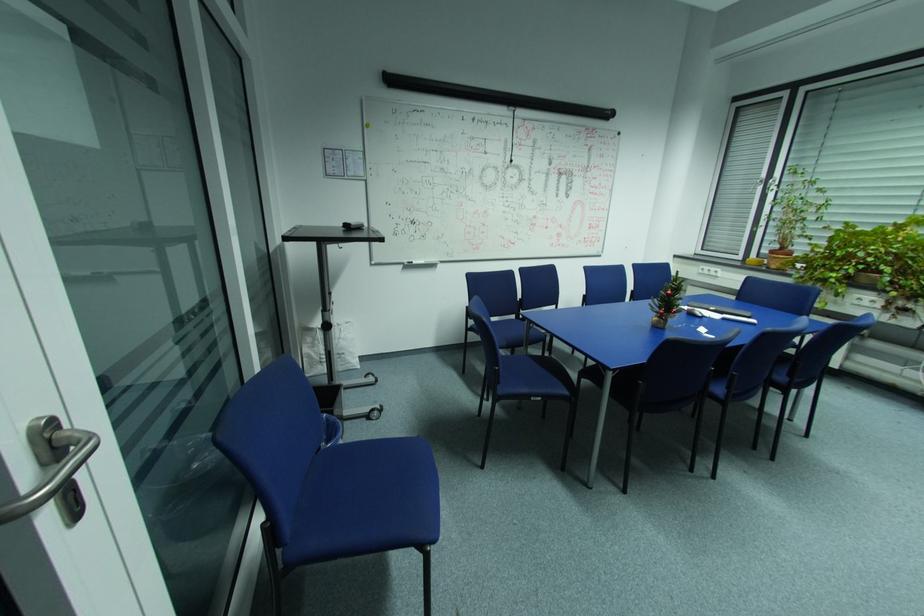
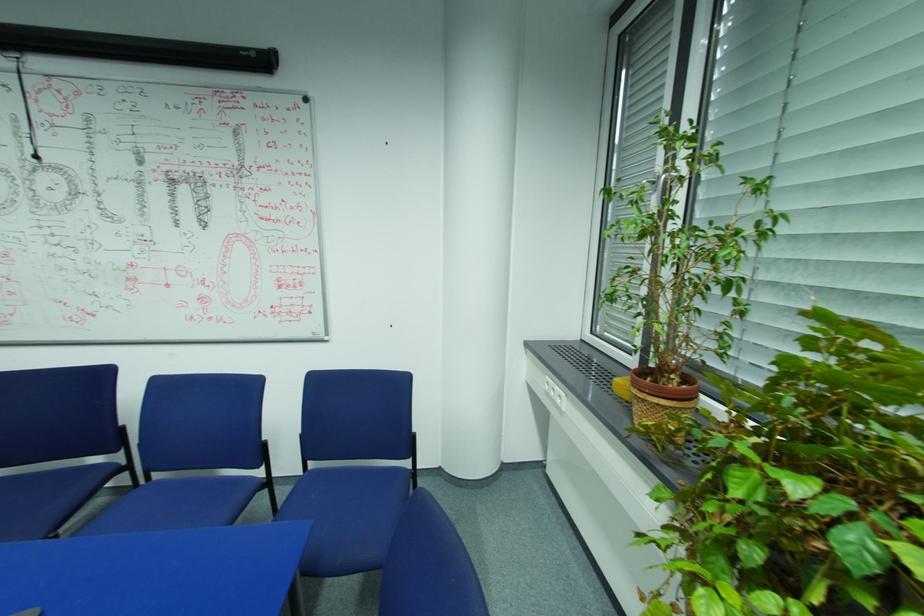
Which direction would the cameraman need to move to produce the second image?

The cameraman moved toward right, forward.